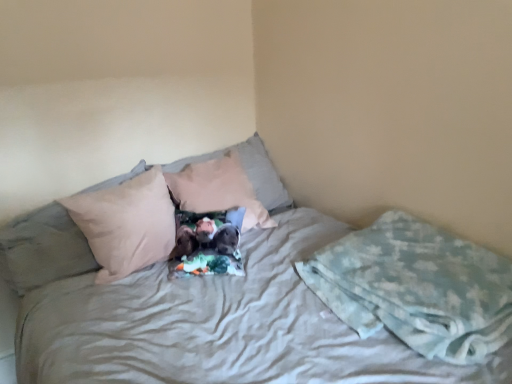
Question: In terms of size, does light brown fabric pillow at center, arranged as the 1th pillow when viewed from the right, appear bigger or smaller than beige fabric pillow at left, which appears as the first pillow when viewed from the left?

Choices:
 (A) small
 (B) big

Answer: (A)

Question: From their relative heights in the image, would you say light brown fabric pillow at center, acting as the 3th pillow starting from the left, is taller or shorter than beige fabric pillow at left, which appears as the first pillow when viewed from the left?

Choices:
 (A) short
 (B) tall

Answer: (A)

Question: Estimate the real-world distances between objects in this image. Which object is closer to the light blue textured blanket at lower right?

Choices:
 (A) light brown fabric pillow at center, acting as the 3th pillow starting from the left
 (B) beige fabric pillow at center, placed as the second pillow when sorted from right to left
 (C) beige fabric pillow at left, which appears as the first pillow when viewed from the left

Answer: (A)

Question: Considering the real-world distances, which object is farthest from the beige fabric pillow at left, which appears as the first pillow when viewed from the left?

Choices:
 (A) beige fabric pillow at center, placed as the second pillow when sorted from right to left
 (B) light brown fabric pillow at center, acting as the 3th pillow starting from the left
 (C) light blue textured blanket at lower right

Answer: (C)